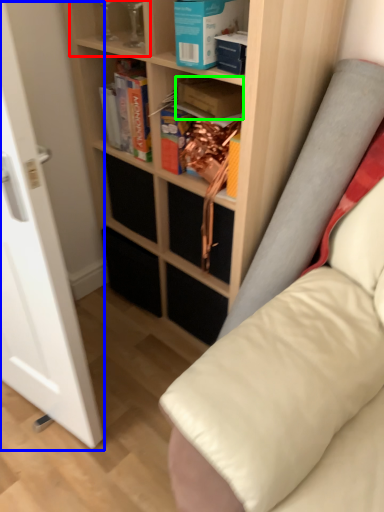
Question: Which is nearer to the shelf (highlighted by a red box)? glass door (highlighted by a blue box) or paperback book (highlighted by a green box).

Choices:
 (A) glass door
 (B) paperback book

Answer: (B)